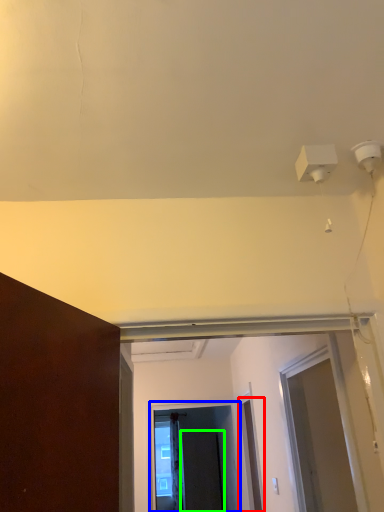
Question: Estimate the real-world distances between objects in this image. Which object is closer to door (highlighted by a red box), screen door (highlighted by a blue box) or screen door (highlighted by a green box)?

Choices:
 (A) screen door
 (B) screen door

Answer: (A)